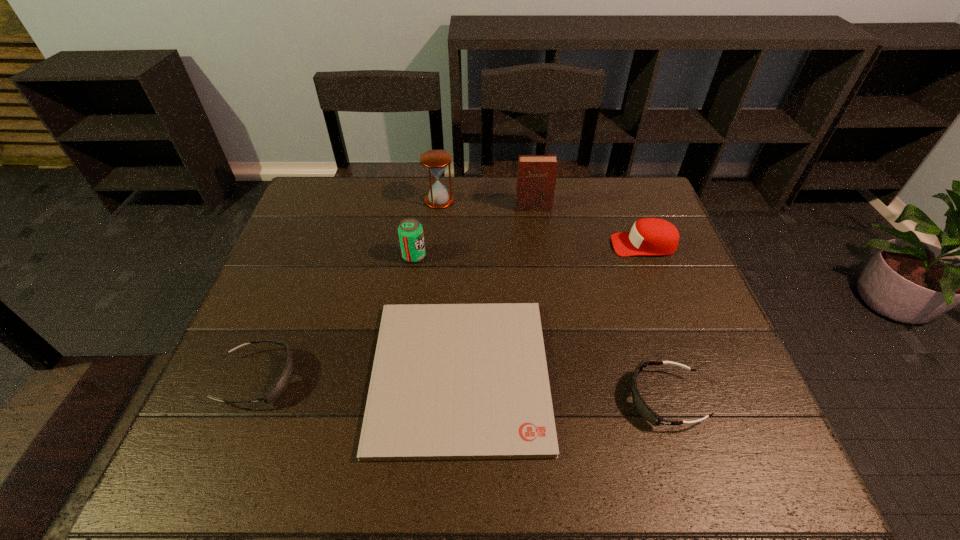
Find the location of `diary`. diary is located at coordinates (536, 178).

This screenshot has width=960, height=540. Identify the location of hourglass. (436, 161).

Where is `the fifth shortest object`? The width and height of the screenshot is (960, 540). the fifth shortest object is located at coordinates (410, 231).

Where is `baseball cap`? baseball cap is located at coordinates (649, 236).

Identify the location of the left goggles. (281, 384).

Where is `the right goggles`? the right goggles is located at coordinates (645, 411).

Where is `clipboard`? The height and width of the screenshot is (540, 960). clipboard is located at coordinates tap(449, 381).

Where is `vacant region located 0.230m on the front cover of the diary`? vacant region located 0.230m on the front cover of the diary is located at coordinates (540, 262).

At what (x,y) coordinates should I click in order to perform the action: click on blank area located on the back of the hourglass. Please return your answer as a coordinate pair (x, y). This screenshot has width=960, height=540. Looking at the image, I should click on (442, 179).

You are a GUI agent. You are given a task and a screenshot of the screen. Output one action in this format:
    pyautogui.click(x=<x>, y=<y>)
    Task: Click on the blank space located 0.190m on the front-facing side of the pop soda
    The width and height of the screenshot is (960, 540).
    Given the screenshot: What is the action you would take?
    pyautogui.click(x=493, y=256)